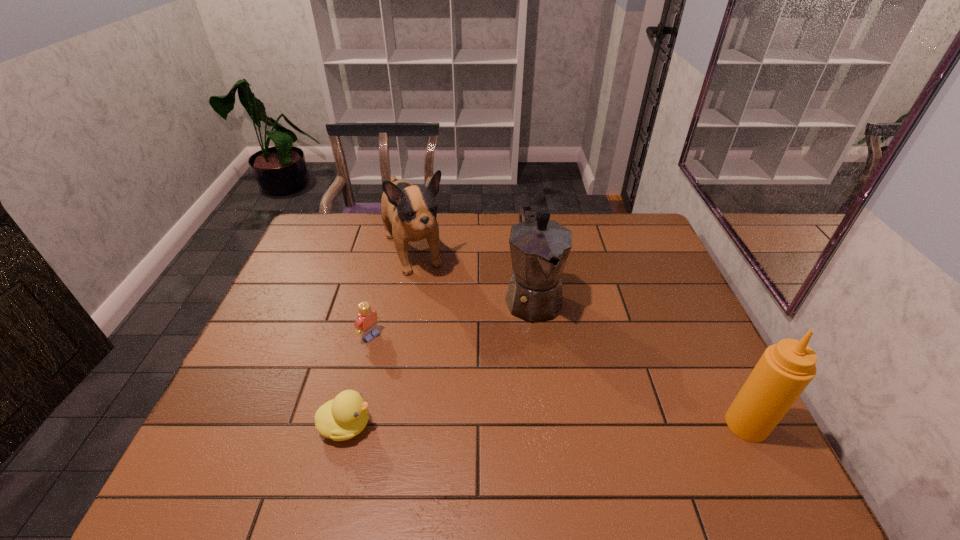
Where is `free spot located at the face of the puppy`? The image size is (960, 540). free spot located at the face of the puppy is located at coordinates (444, 330).

Identify the location of free location located at the face of the puppy. (438, 316).

You are a GUI agent. You are given a task and a screenshot of the screen. Output one action in this format:
    pyautogui.click(x=<x>, y=<y>)
    Task: Click on the free region located 0.190m at the face of the puppy
    This screenshot has height=540, width=960.
    Given the screenshot: What is the action you would take?
    pyautogui.click(x=443, y=325)

What are the coordinates of `blank space located on the pouring side of the coffeepot` in the screenshot? It's located at (566, 381).

Where is `vacant space located on the pouring side of the coffeepot`? vacant space located on the pouring side of the coffeepot is located at coordinates (579, 408).

At what (x,y) coordinates should I click in order to perform the action: click on vacant space located 0.330m on the pouring side of the coffeepot. Please return your answer as a coordinate pair (x, y). Looking at the image, I should click on (592, 438).

Image resolution: width=960 pixels, height=540 pixels. What are the coordinates of `object present at the far edge` in the screenshot? It's located at (409, 212).

Locate an element on the screen. The image size is (960, 540). duckling that is at the near edge is located at coordinates (345, 416).

Where is `condiment at the near edge`? This screenshot has height=540, width=960. condiment at the near edge is located at coordinates (785, 369).

The width and height of the screenshot is (960, 540). Identify the location of object present at the right edge. (785, 369).